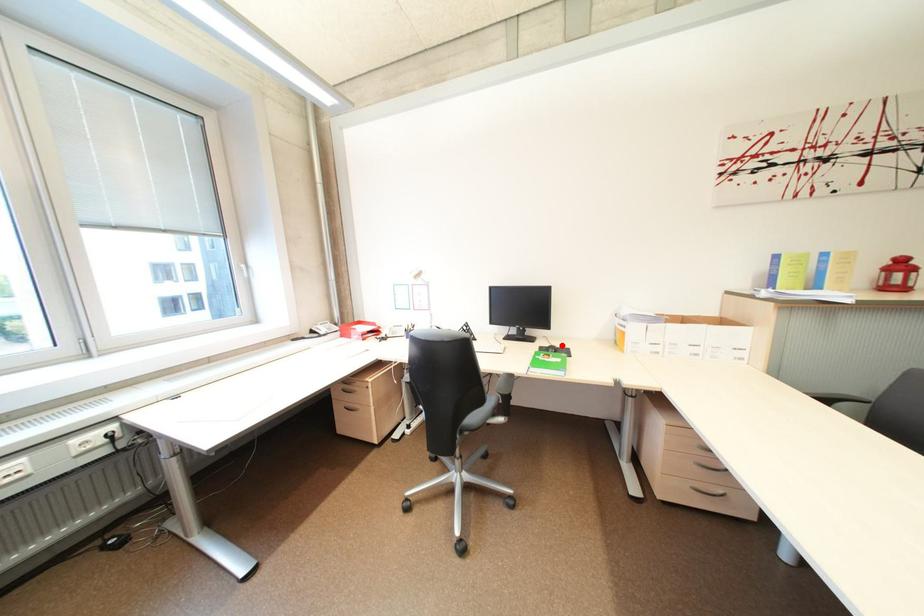
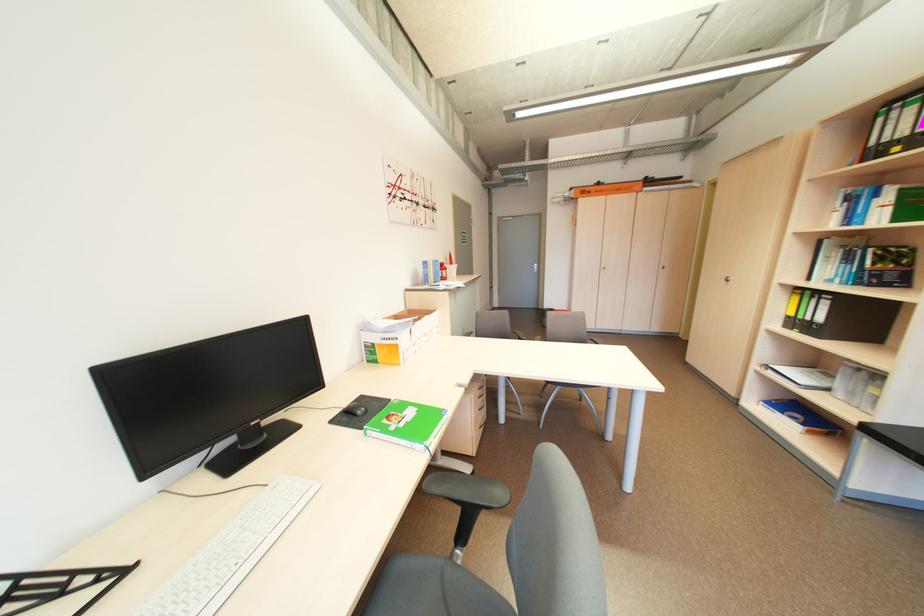
Locate, in the second image, the point that corresponds to the highlighted location in the first image.

(354, 406)